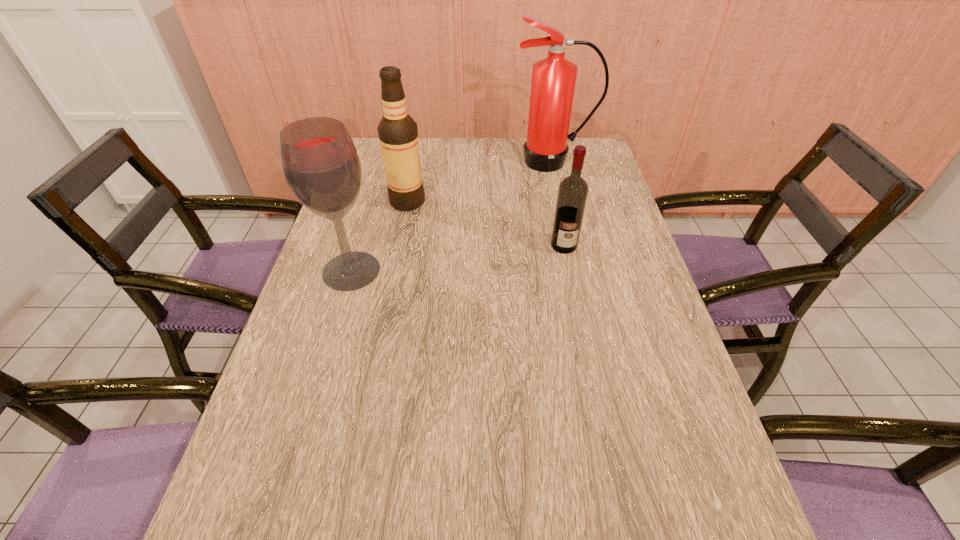
Select which alcohol appears as the closest to the fire extinguisher. Please provide its 2D coordinates. Your answer should be formatted as a tuple, i.e. [(x, y)], where the tuple contains the x and y coordinates of a point satisfying the conditions above.

[(398, 134)]

What are the coordinates of `free space that satisfies the following two spatial constraints: 1. at the spray nozzle of the fire extinguisher; 2. on the label of the second farthest object` in the screenshot? It's located at (562, 201).

Where is `free space that satisfies the following two spatial constraints: 1. at the spray nozzle of the farthest object; 2. on the label of the farthest alcohol`? free space that satisfies the following two spatial constraints: 1. at the spray nozzle of the farthest object; 2. on the label of the farthest alcohol is located at coordinates (562, 201).

The image size is (960, 540). Identify the location of vacant region that satisfies the following two spatial constraints: 1. at the spray nozzle of the farthest object; 2. on the label of the farthest alcohol. (562, 201).